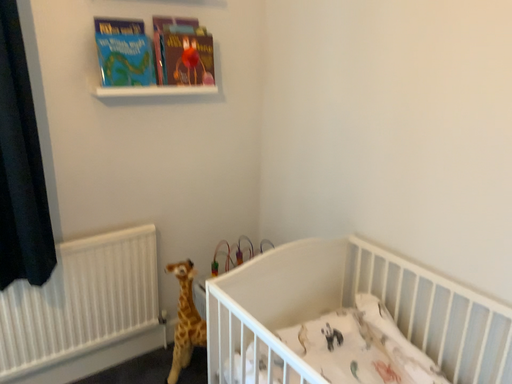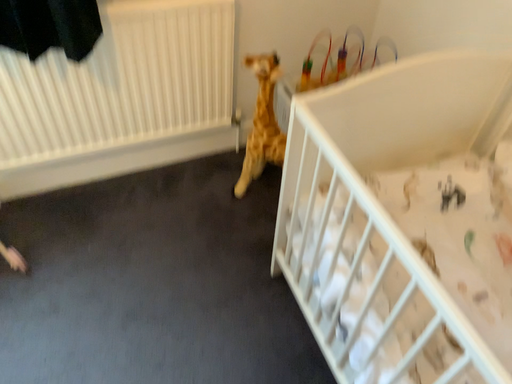
Question: How did the camera likely rotate when shooting the video?

Choices:
 (A) rotated right
 (B) rotated left

Answer: (B)